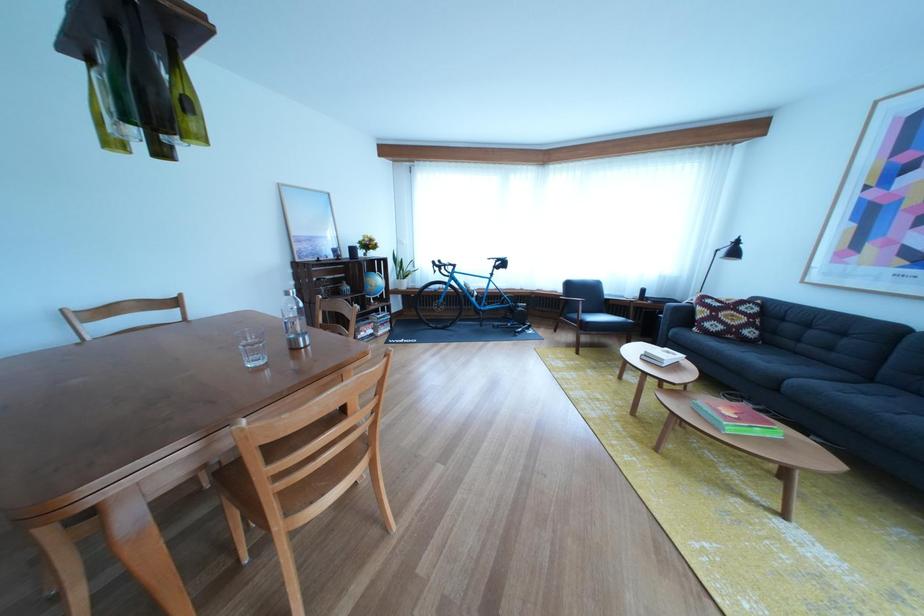
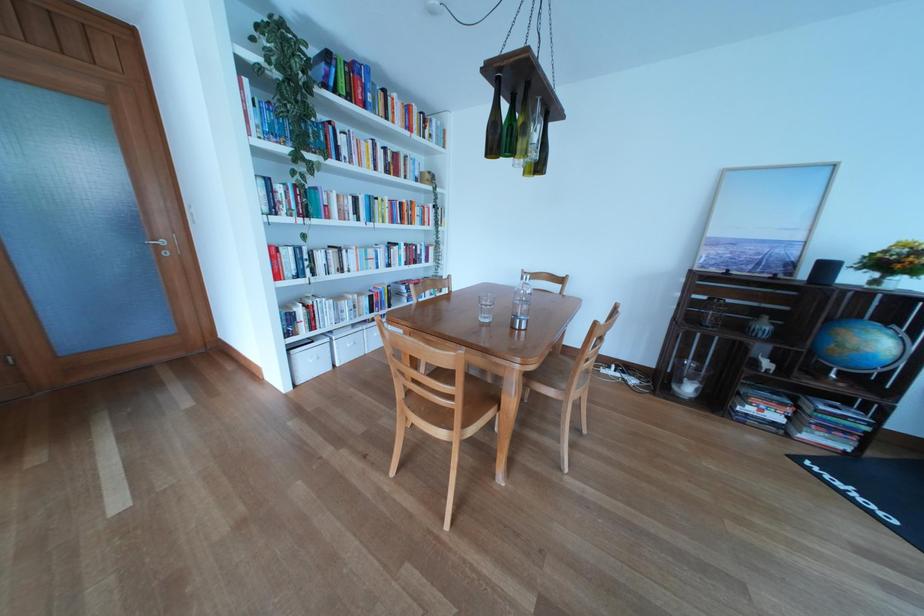
In the second image, find the point that corresponds to point (375, 341) in the first image.

(762, 416)